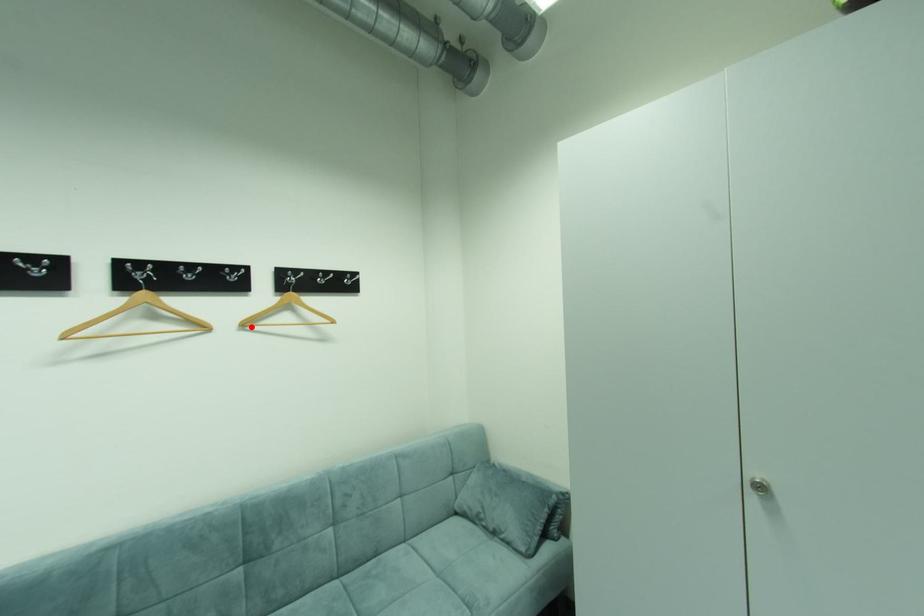
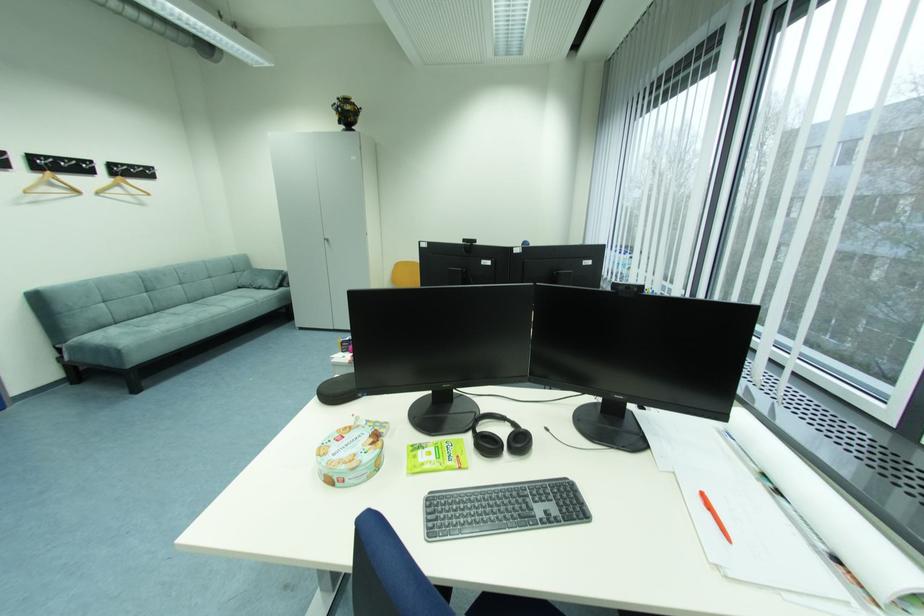
The point at the highlighted location is marked in the first image. Where is the corresponding point in the second image?

(104, 193)